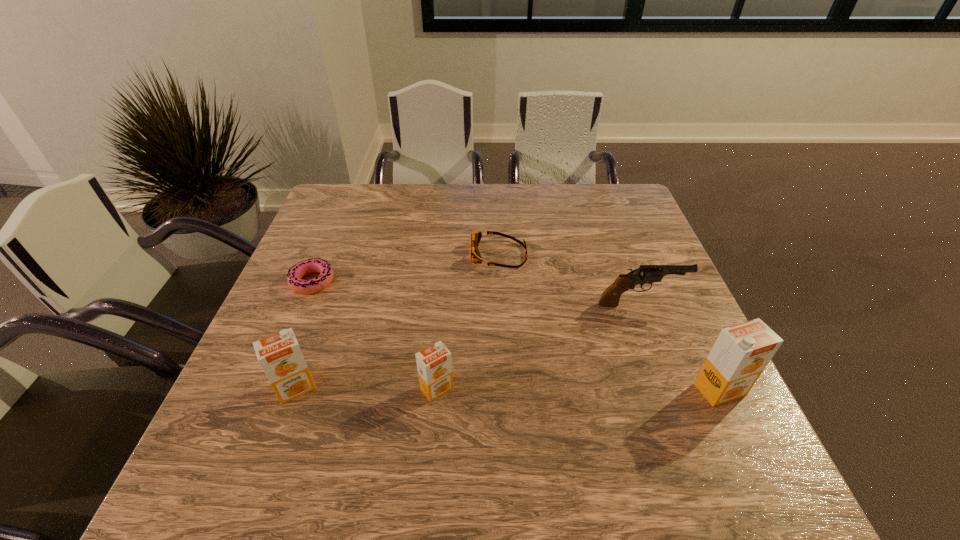
Where is `object that stands as the third closest to the fourth object from right to left`? object that stands as the third closest to the fourth object from right to left is located at coordinates (313, 265).

Identify which object is the fourth nearest to the tallest object. Please provide its 2D coordinates. Your answer should be formatted as a tuple, i.e. [(x, y)], where the tuple contains the x and y coordinates of a point satisfying the conditions above.

[(279, 355)]

At what (x,y) coordinates should I click in order to perform the action: click on orange juice that stands as the second closest to the fifth tallest object. Please return your answer as a coordinate pair (x, y). The height and width of the screenshot is (540, 960). Looking at the image, I should click on (279, 355).

Image resolution: width=960 pixels, height=540 pixels. I want to click on orange juice that is the third nearest to the doughnut, so click(740, 354).

I want to click on free space that satisfies the following two spatial constraints: 1. on the back side of the tallest orange juice; 2. with the lenses facing forward on the goggles, so click(x=657, y=254).

Find the location of a particular element. This screenshot has width=960, height=540. free space that satisfies the following two spatial constraints: 1. with the lenses facing forward on the second shortest object; 2. on the front side of the doughnut is located at coordinates (500, 282).

You are a GUI agent. You are given a task and a screenshot of the screen. Output one action in this format:
    pyautogui.click(x=<x>, y=<y>)
    Task: Click on the free space that satisfies the following two spatial constraints: 1. with the lenses facing forward on the fifth tallest object; 2. on the back side of the rightmost orange juice
    
    Given the screenshot: What is the action you would take?
    pyautogui.click(x=505, y=389)